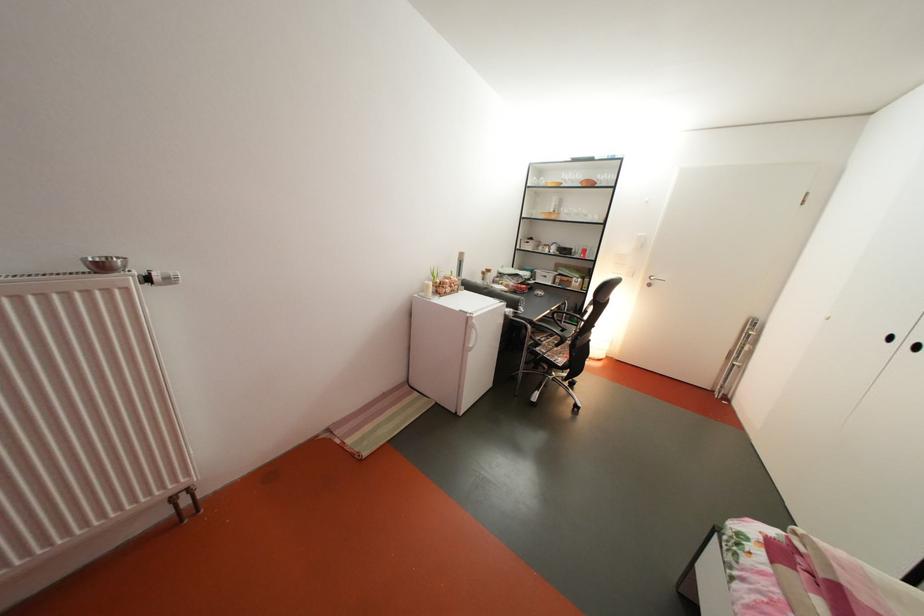
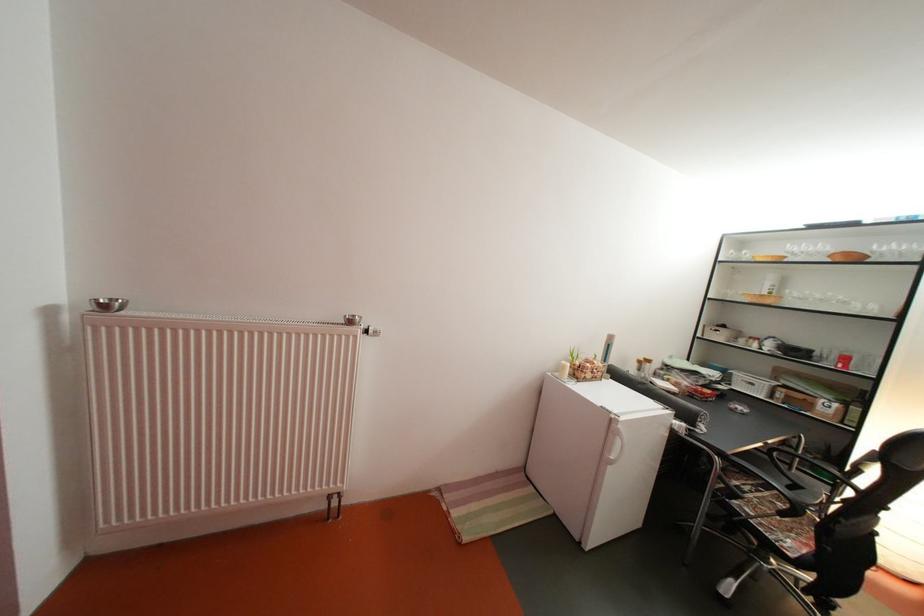
Question: The images are taken continuously from a first-person perspective. In which direction is your viewpoint rotating?

Choices:
 (A) Left
 (B) Right
 (C) Up
 (D) Down

Answer: (A)